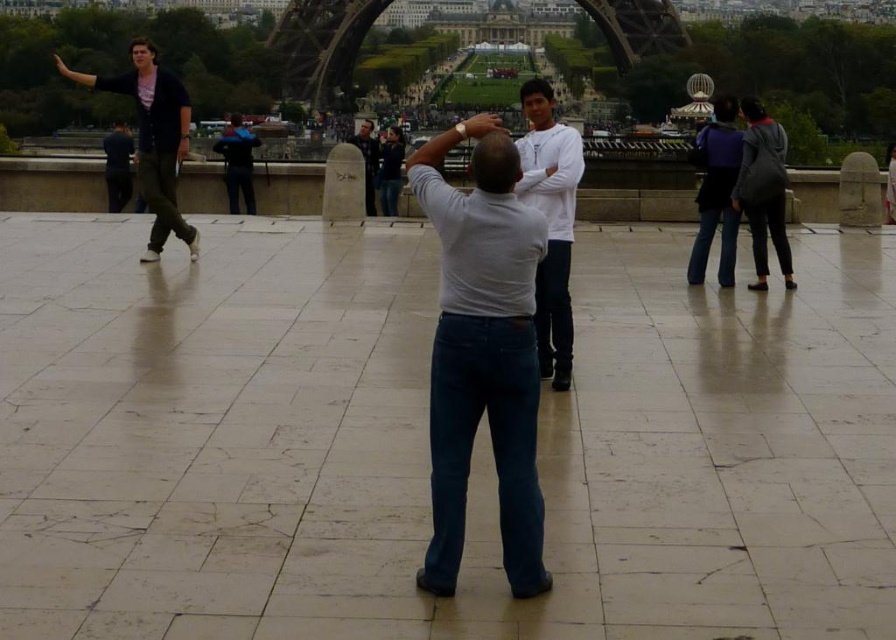
Which is more to the left, metallic structure at center or blue denim jeans at center?

Positioned to the left is blue denim jeans at center.

Between metallic structure at center and blue denim jeans at center, which one has more height?

metallic structure at center is taller.

Which is behind, point (328, 61) or point (228, 125)?

The point (328, 61) is more distant.

I want to click on metallic structure at center, so click(x=321, y=49).

Image resolution: width=896 pixels, height=640 pixels. Describe the element at coordinates (763, 192) in the screenshot. I see `dark gray hoodie at right` at that location.

Who is more forward, (750, 289) or (389, 202)?

Point (750, 289) is in front.

Which is behind, point (748, 198) or point (392, 161)?

The point (392, 161) is behind.

I want to click on dark gray hoodie at right, so click(x=763, y=192).

Is point (279, 35) positioned in front of point (703, 131)?

No.

Which is in front, point (268, 44) or point (708, 220)?

Positioned in front is point (708, 220).

This screenshot has width=896, height=640. Identify the location of metallic structure at center. (321, 49).